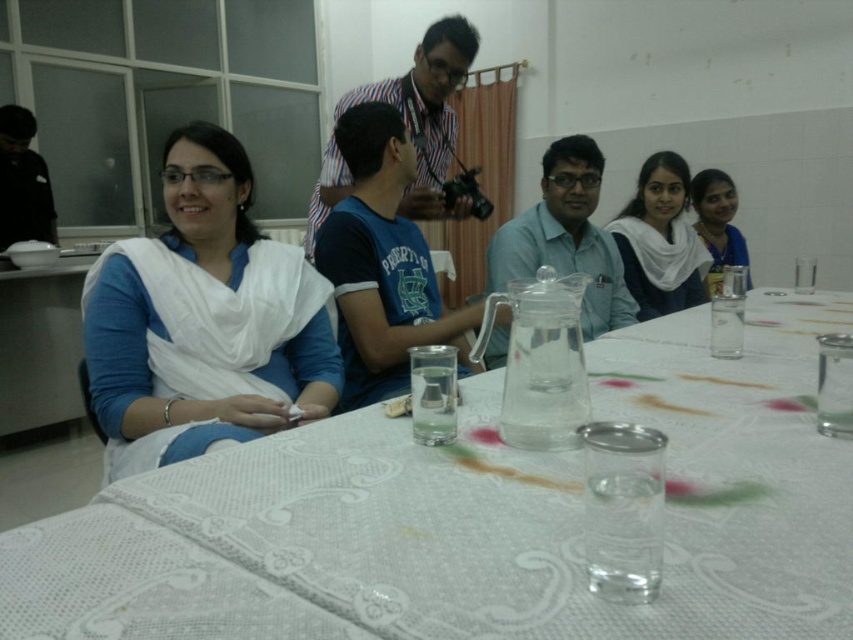
Question: Is the position of white fabric at center more distant than that of matte glass pitcher at center?

Choices:
 (A) yes
 (B) no

Answer: (B)

Question: Among these points, which one is nearest to the camera?

Choices:
 (A) (718, 237)
 (B) (206, 593)
 (C) (524, 244)

Answer: (B)

Question: Is white lace tablecloth at center to the right of matte blue dress at upper right from the viewer's perspective?

Choices:
 (A) no
 (B) yes

Answer: (A)

Question: Which point is farther from the camera taking this photo?

Choices:
 (A) (503, 362)
 (B) (73, 529)

Answer: (A)

Question: Which point appears closest to the camera in this image?

Choices:
 (A) (178, 516)
 (B) (599, 259)
 (C) (280, 282)
 (D) (709, 225)

Answer: (A)

Question: Is matte glass pitcher at center above matte blue dress at upper right?

Choices:
 (A) yes
 (B) no

Answer: (B)